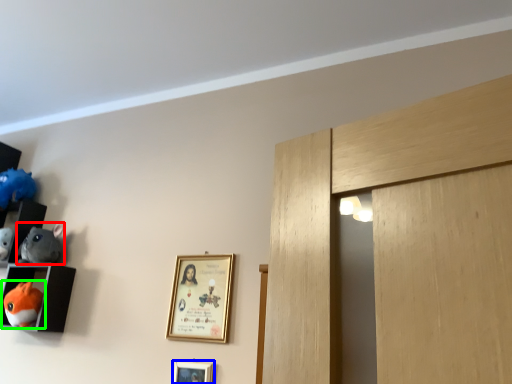
Question: Which object is positioned farthest from toy (highlighted by a red box)? Select from picture frame (highlighted by a blue box) and toy (highlighted by a green box).

Choices:
 (A) picture frame
 (B) toy

Answer: (A)